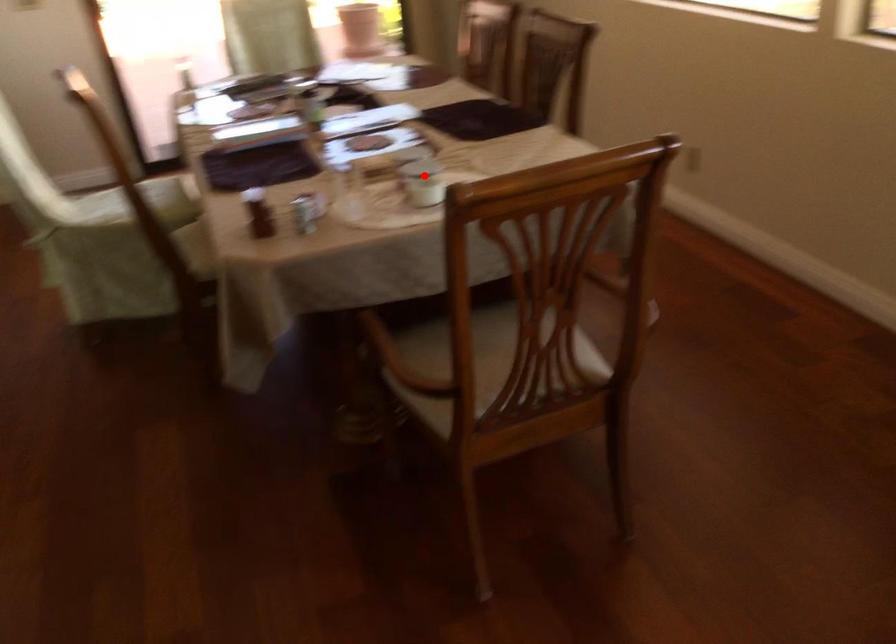
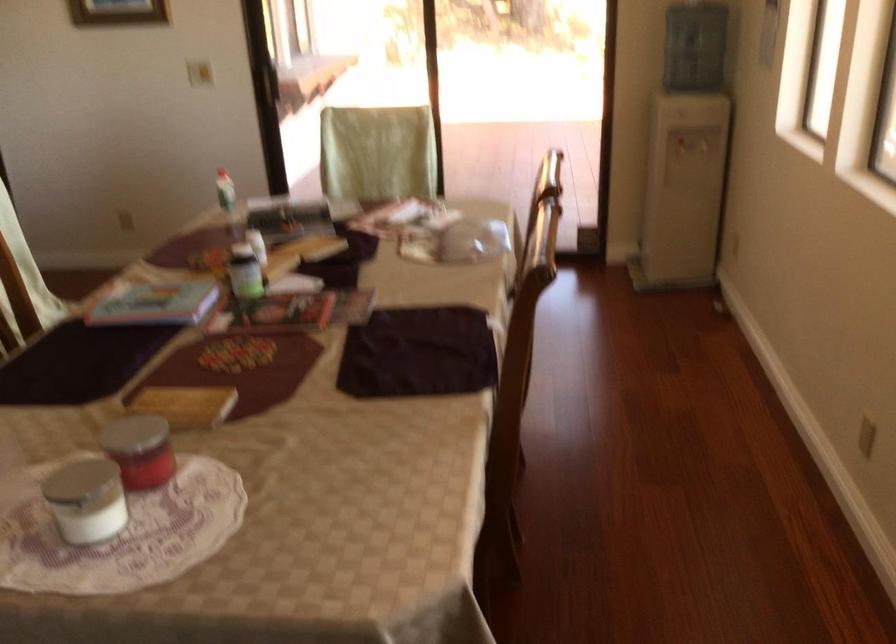
Question: A red point is marked in image1. In image2, is the corresponding 3D point closer to the camera or farther? Reply with the corresponding letter.

Choices:
 (A) The corresponding 3D point is closer.
 (B) The corresponding 3D point is farther.

Answer: (A)